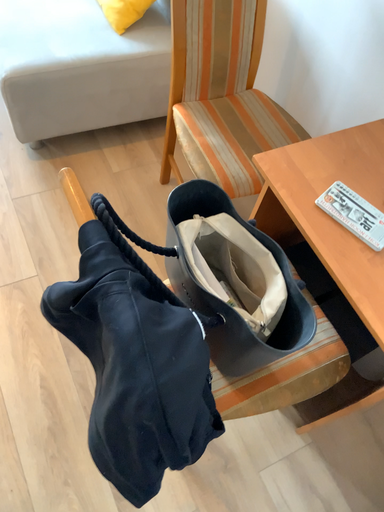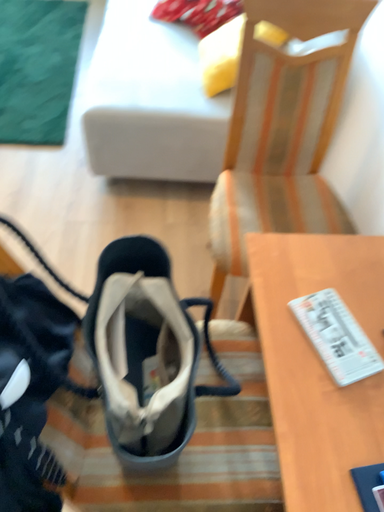
Question: Which way did the camera rotate in the video?

Choices:
 (A) rotated right
 (B) rotated left

Answer: (B)